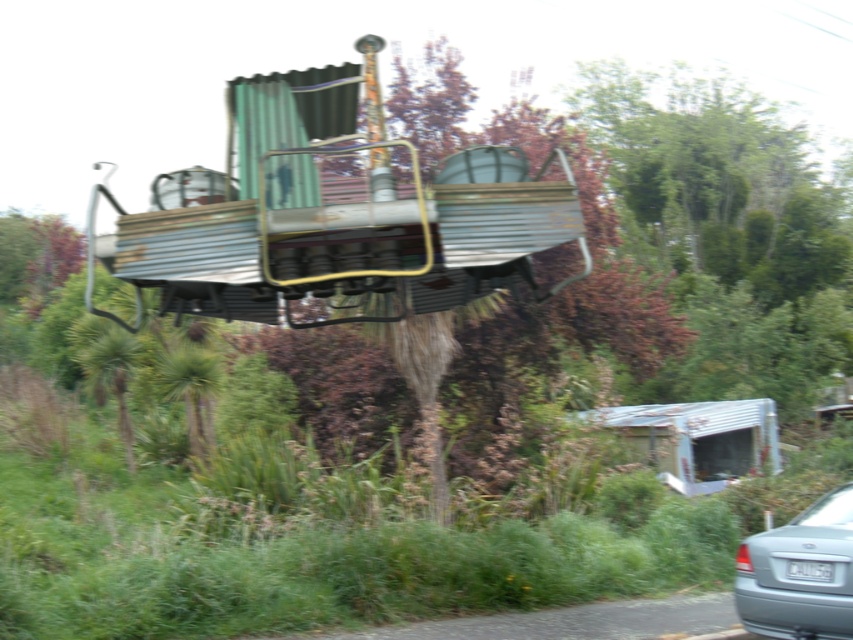
Measure the distance between corrugated metal train car at center and silver metallic car at lower right.

They are 4.29 meters apart.

Between corrugated metal train car at center and silver metallic car at lower right, which one has more height?

silver metallic car at lower right

At what (x,y) coordinates should I click in order to perform the action: click on corrugated metal train car at center. Please return your answer as a coordinate pair (x, y). The image size is (853, 640). Looking at the image, I should click on (334, 221).

The width and height of the screenshot is (853, 640). I want to click on corrugated metal train car at center, so click(334, 221).